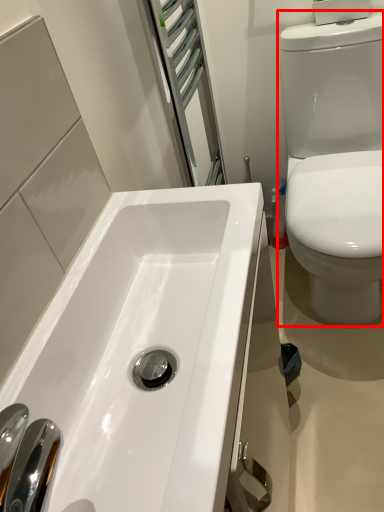
Question: From the image's perspective, considering the relative positions of toilet (annotated by the red box) and sink in the image provided, where is toilet (annotated by the red box) located with respect to the staircase?

Choices:
 (A) below
 (B) above

Answer: (B)